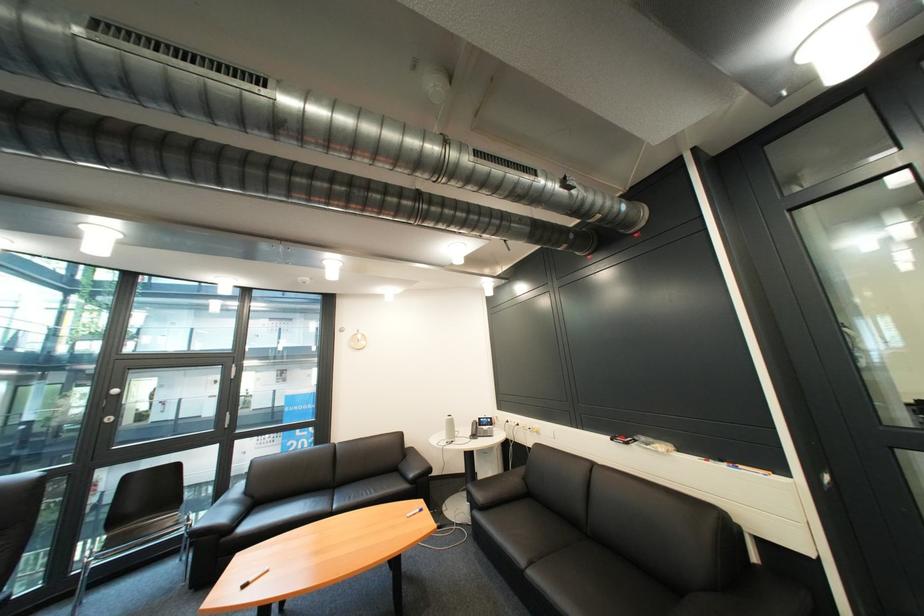
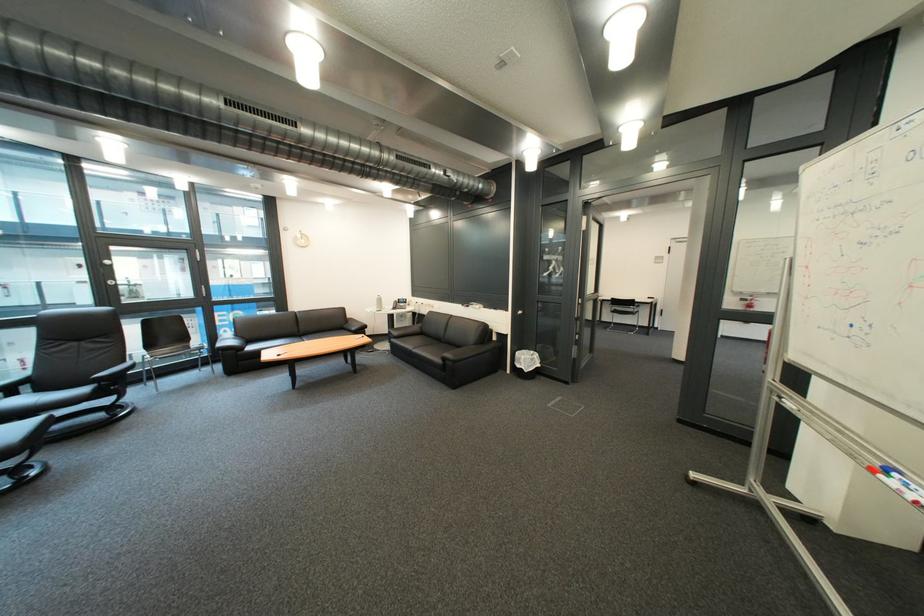
In the second image, find the point that corresponds to (347,483) in the first image.

(312, 334)